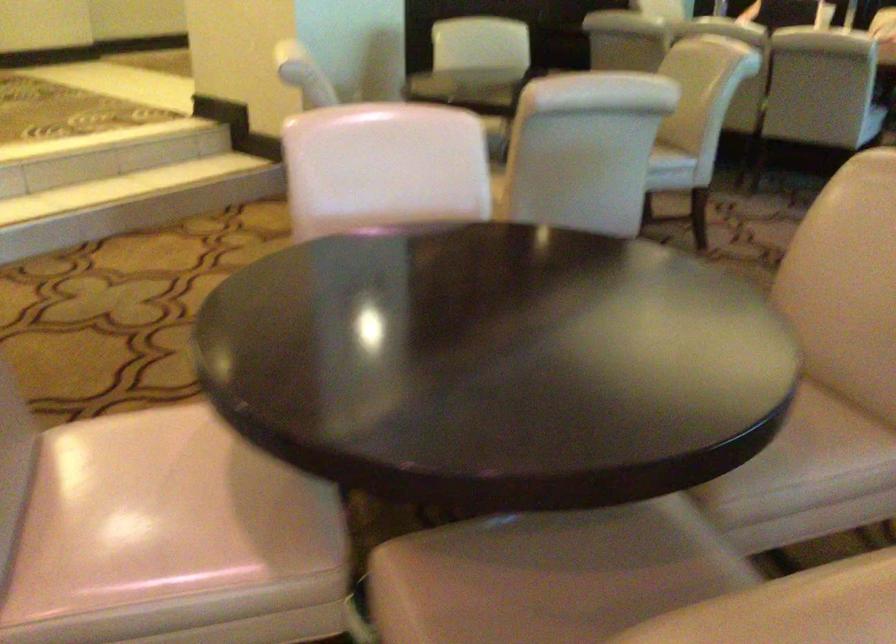
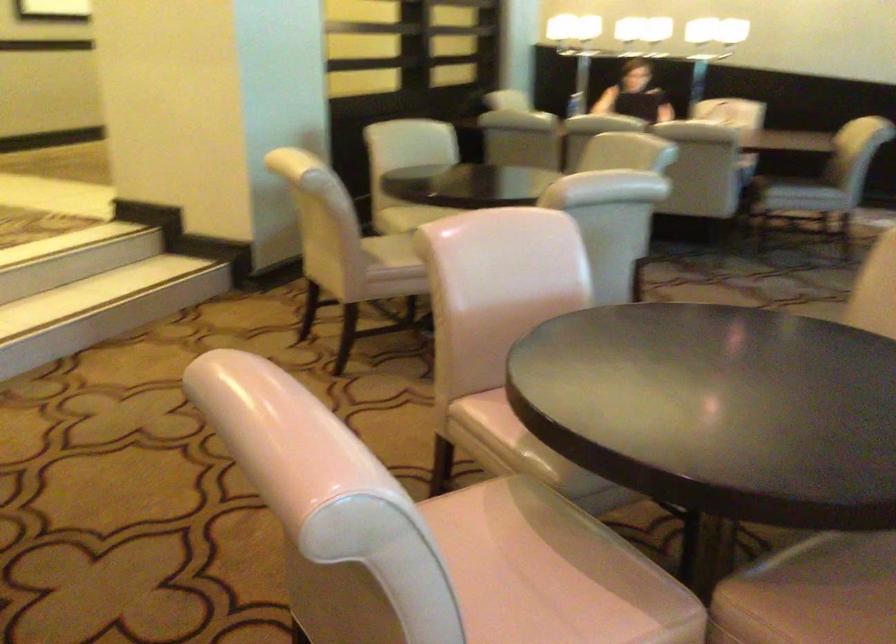
Locate, in the second image, the point that corresponds to pixel 166 513 in the first image.

(520, 587)